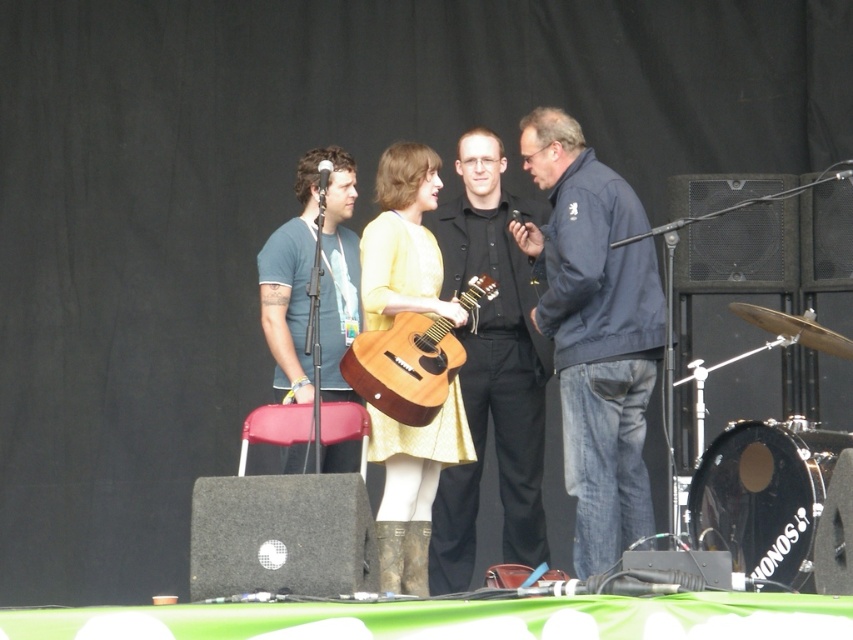
You are a costume designer preparing for a performance. You have two shirts available for an actor who needs to wear a shirt that is wider than the other. Which shirt should you choose between the black matte shirt at center and the matte blue shirt at center?

The black matte shirt at center is wider than the matte blue shirt at center, so you should choose the black matte shirt at center.

You are a stagehand preparing to move the dark blue jacket at center and the matte blue shirt at center. Which object is closer to the front of the stage?

The dark blue jacket at center is closer to the front of the stage because the matte blue shirt at center is behind it.